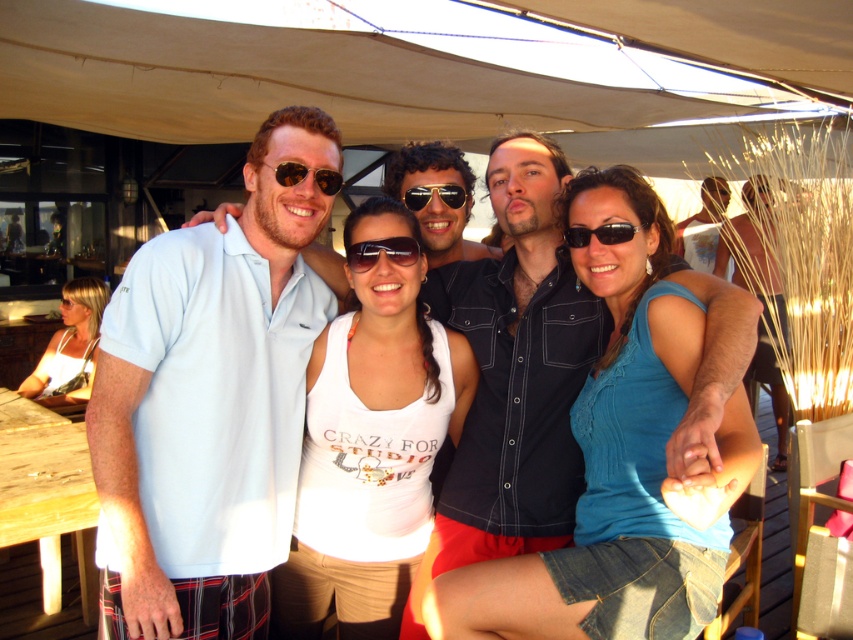
You are standing in front of the group of people under the canopy. If you want to take a photo that includes both the point at position (426, 522) and the point at position (461, 193), which point should you focus on first to ensure both are in focus?

You should focus on point (461, 193) first because it is farther from the camera than point (426, 522), ensuring both points will be in focus when focusing on the farther one.

You are a photographer trying to capture a closeup of the text on the white tank top at center without the sunglasses at center blocking the view. Based on their sizes, is this possible?

The white tank top at center is larger in size than the sunglasses at center, so it is possible to capture a closeup of the text on the white tank top at center without the sunglasses at center blocking the view.

You are a photographer at the event and want to capture a closeup shot of the white tank top at center without the matte black sunglasses at upper center appearing in the frame. Given that your camera has a lens with a 50mm focal length, which is best suited for portraits, can you determine if you can achieve this by adjusting your position? Assume the minimum focusing distance of the lens is 3 feet.

The distance between the white tank top at center and the matte black sunglasses at upper center is 27.84 inches. Since the minimum focusing distance of the lens is 3 feet, which is 36 inches, you can move closer to the subject until you are within 36 inches. At this distance, the 50mm lens should allow you to frame the white tank top at center tightly enough to exclude the matte black sunglasses at upper center, which are only 27.84 inches away.